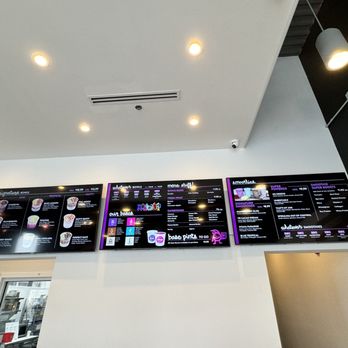
Identify the location of wall below black board. (103, 311).